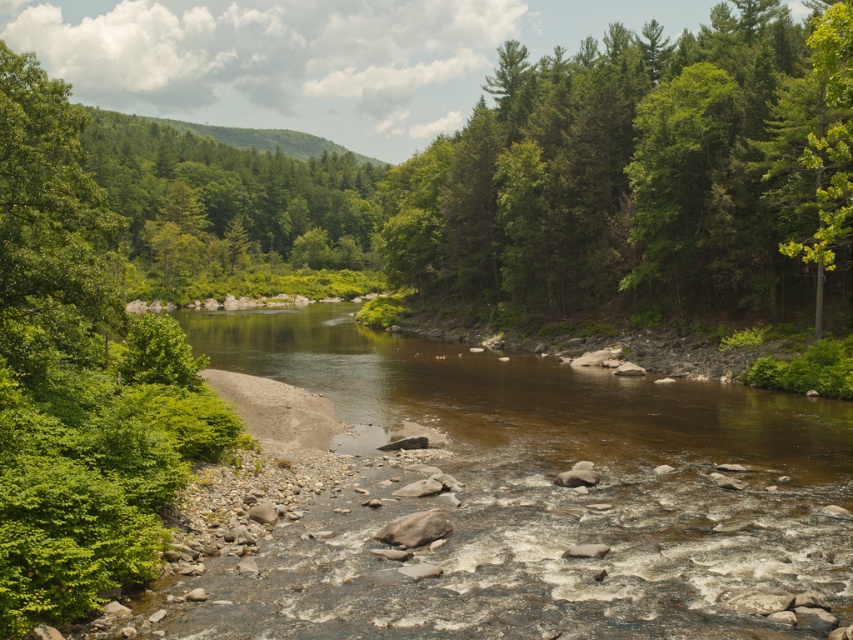
You are standing at the point marked as point (45,323) in the image. The camera is positioned 16.52 meters away from you. If you want to take a photo of the river flowing through the forest, which direction should you face to ensure the camera captures the entire scene?

Since the camera is 16.52 meters away from point (45,323), you should face the direction opposite to the camera to capture the entire scene of the river flowing through the forest.

You are standing at the origin point of the coordinate system in the image. You want to cross the river. The brown smooth river at center is located at point (532, 493). Which direction should you move to reach the brown smooth river at center?

You should move towards the point (532, 493) to reach the brown smooth river at center.

You are a hiker standing at the edge of the river and looking towards the center of the image. You see the green leafy trees at upper right and the green leafy tree at center. Which of these two trees is closer to you?

The green leafy trees at upper right is positioned under the green leafy tree at center, meaning it is closer to you since objects positioned under others in the scene are typically closer in the foreground.